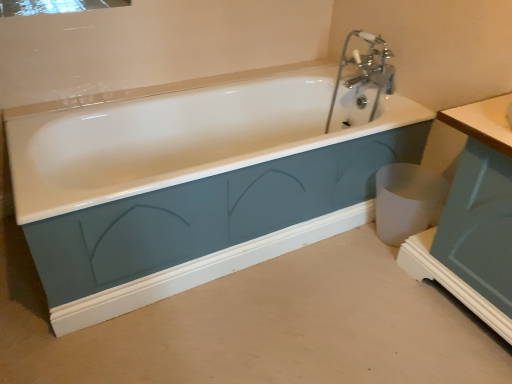
At what (x,y) coordinates should I click in order to perform the action: click on vacant space that is to the left of white matte trash can at lower right. Please return your answer as a coordinate pair (x, y). The height and width of the screenshot is (384, 512). Looking at the image, I should click on (356, 240).